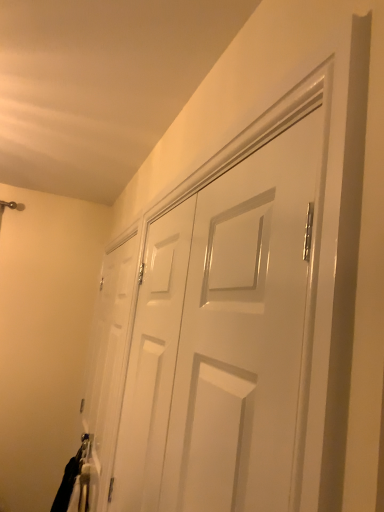
Image resolution: width=384 pixels, height=512 pixels. What do you see at coordinates (109, 361) in the screenshot? I see `white glossy door at center, the 2th door viewed from the right` at bounding box center [109, 361].

Locate an element on the screen. black fabric laundry at lower left is located at coordinates (76, 478).

Are white glossy door at center, the first door in the right-to-left sequence, and white glossy door at center, the 2th door viewed from the right, located far from each other?

No, white glossy door at center, the first door in the right-to-left sequence, is not far from white glossy door at center, the 2th door viewed from the right.

Who is taller, white glossy door at center, the 2th door in the back-to-front sequence, or white glossy door at center, the 2th door viewed from the right?

Standing taller between the two is white glossy door at center, the 2th door viewed from the right.

Considering the sizes of white glossy door at center, acting as the second door starting from the left, and white glossy door at center, arranged as the first door when viewed from the back, in the image, is white glossy door at center, acting as the second door starting from the left, wider or thinner than white glossy door at center, arranged as the first door when viewed from the back,?

white glossy door at center, acting as the second door starting from the left, is wider than white glossy door at center, arranged as the first door when viewed from the back.

Considering the sizes of black fabric laundry at lower left and white glossy door at center, arranged as the first door when viewed from the back, in the image, is black fabric laundry at lower left taller or shorter than white glossy door at center, arranged as the first door when viewed from the back,?

black fabric laundry at lower left is shorter than white glossy door at center, arranged as the first door when viewed from the back.

From a real-world perspective, which object stands above the other?

white glossy door at center, which is counted as the first door, starting from the left, from a real-world perspective.

Considering the points (76, 475) and (111, 261), which point is in front, point (76, 475) or point (111, 261)?

The point (76, 475) is closer to the camera.

In the image, there is a white glossy door at center, which is the 2th door from front to back. At what (x,y) coordinates should I click in order to perform the action: click on laundry below it (from the image's perspective). Please return your answer as a coordinate pair (x, y). The height and width of the screenshot is (512, 384). Looking at the image, I should click on (x=76, y=478).

In the scene shown: Is white glossy door at center, the first door in the right-to-left sequence, to the left or to the right of black fabric laundry at lower left in the image?

Based on their positions, white glossy door at center, the first door in the right-to-left sequence, is located to the right of black fabric laundry at lower left.

Which of these two, white glossy door at center, acting as the second door starting from the left, or black fabric laundry at lower left, is smaller?

white glossy door at center, acting as the second door starting from the left, is smaller.

From a real-world perspective, is white glossy door at center, the first door in the right-to-left sequence, on black fabric laundry at lower left?

Correct, in the physical world, white glossy door at center, the first door in the right-to-left sequence, is higher than black fabric laundry at lower left.

Choose the correct answer: Is white glossy door at center, acting as the second door starting from the left, inside black fabric laundry at lower left or outside it?

white glossy door at center, acting as the second door starting from the left, lies outside black fabric laundry at lower left.

Is white glossy door at center, which is counted as the first door, starting from the left, positioned with its back to white glossy door at center, the 2th door in the back-to-front sequence?

No, white glossy door at center, which is counted as the first door, starting from the left, is not facing away from white glossy door at center, the 2th door in the back-to-front sequence.

From a real-world perspective, is white glossy door at center, which is counted as the first door, starting from the left, on top of white glossy door at center, acting as the second door starting from the left?

No, from a real-world perspective, white glossy door at center, which is counted as the first door, starting from the left, is not above white glossy door at center, acting as the second door starting from the left.

Between white glossy door at center, the 2th door viewed from the right, and white glossy door at center, the 2th door in the back-to-front sequence, which one has larger width?

Wider between the two is white glossy door at center, the 2th door in the back-to-front sequence.

Who is smaller, white glossy door at center, the 2th door viewed from the right, or black fabric laundry at lower left?

white glossy door at center, the 2th door viewed from the right.

In terms of width, does white glossy door at center, which is counted as the first door, starting from the left, look wider or thinner when compared to black fabric laundry at lower left?

Considering their sizes, white glossy door at center, which is counted as the first door, starting from the left, looks slimmer than black fabric laundry at lower left.

Which of these two, white glossy door at center, arranged as the first door when viewed from the back, or black fabric laundry at lower left, stands shorter?

Standing shorter between the two is black fabric laundry at lower left.

From the image's perspective, is white glossy door at center, the 2th door viewed from the right, on top of black fabric laundry at lower left?

Yes, from the image's perspective, white glossy door at center, the 2th door viewed from the right, is over black fabric laundry at lower left.

Choose the correct answer: Is black fabric laundry at lower left inside white glossy door at center, which is the first door in front-to-back order, or outside it?

The correct answer is: outside.

Is white glossy door at center, which is the first door in front-to-back order, at the back of black fabric laundry at lower left?

black fabric laundry at lower left does not have its back to white glossy door at center, which is the first door in front-to-back order.

Considering the relative positions of black fabric laundry at lower left and white glossy door at center, which is the first door in front-to-back order, in the image provided, is black fabric laundry at lower left behind white glossy door at center, which is the first door in front-to-back order,?

Yes, it is.

Where is `door on the left of white glossy door at center, the 2th door in the back-to-front sequence`? This screenshot has width=384, height=512. door on the left of white glossy door at center, the 2th door in the back-to-front sequence is located at coordinates (109, 361).

Identify the location of door that is the 1st object located in front of the black fabric laundry at lower left. The image size is (384, 512). (109, 361).

Consider the image. Which object lies nearer to the anchor point white glossy door at center, acting as the second door starting from the left, white glossy door at center, arranged as the first door when viewed from the back, or black fabric laundry at lower left?

white glossy door at center, arranged as the first door when viewed from the back, is positioned closer to the anchor white glossy door at center, acting as the second door starting from the left.

When comparing their distances from black fabric laundry at lower left, does white glossy door at center, the 2th door viewed from the right, or white glossy door at center, the first door in the right-to-left sequence, seem further?

white glossy door at center, the first door in the right-to-left sequence, is further to black fabric laundry at lower left.

From the image, which object appears to be farther from white glossy door at center, the 2th door viewed from the right, white glossy door at center, which is the first door in front-to-back order, or black fabric laundry at lower left?

The object further to white glossy door at center, the 2th door viewed from the right, is white glossy door at center, which is the first door in front-to-back order.

When comparing their distances from black fabric laundry at lower left, does white glossy door at center, the 2th door in the back-to-front sequence, or white glossy door at center, arranged as the first door when viewed from the back, seem further?

Among the two, white glossy door at center, the 2th door in the back-to-front sequence, is located further to black fabric laundry at lower left.

From the image, which object appears to be nearer to white glossy door at center, the 2th door in the back-to-front sequence, black fabric laundry at lower left or white glossy door at center, the 2th door viewed from the right?

white glossy door at center, the 2th door viewed from the right.

From the image, which object appears to be farther from white glossy door at center, which is counted as the first door, starting from the left, black fabric laundry at lower left or white glossy door at center, which is the first door in front-to-back order?

Based on the image, white glossy door at center, which is the first door in front-to-back order, appears to be further to white glossy door at center, which is counted as the first door, starting from the left.

At what (x,y) coordinates should I click in order to perform the action: click on door positioned between white glossy door at center, acting as the second door starting from the left, and black fabric laundry at lower left from near to far. Please return your answer as a coordinate pair (x, y). This screenshot has height=512, width=384. Looking at the image, I should click on point(109,361).